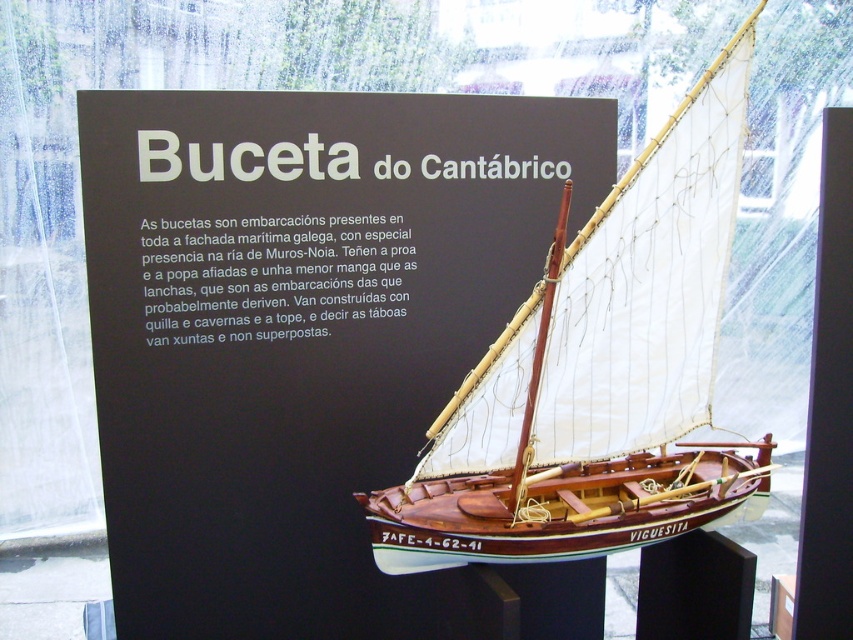
You are a visitor at the museum and want to read the information about the model ship. Where is the matte wood sign at center located relative to the model ship?

The matte wood sign at center is located at point (312, 352) relative to the model ship.